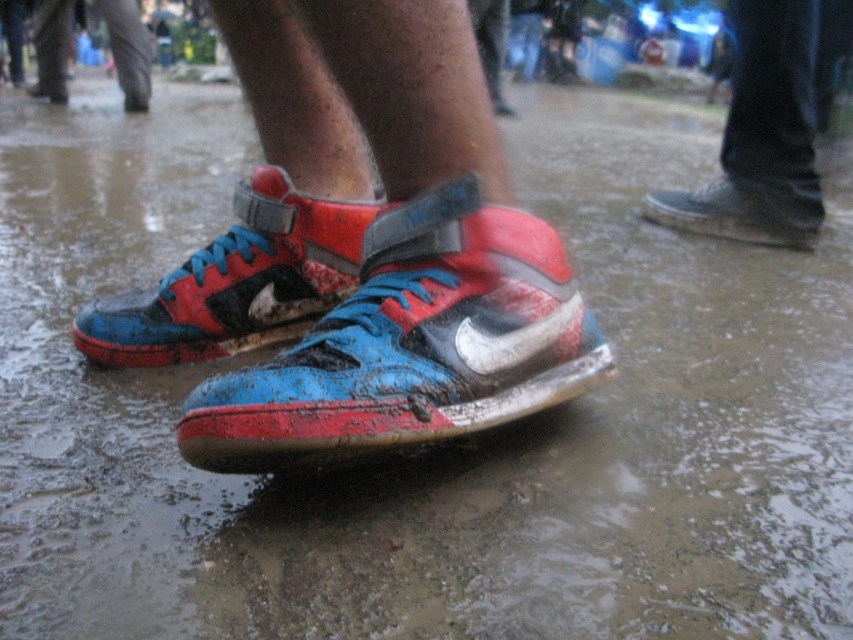
Question: Which object appears farthest from the camera in this image?

Choices:
 (A) matte black shoe at center
 (B) blue matte/suede sneaker at center
 (C) shiny leather sneakers at center
 (D) blue suede shoe at upper right

Answer: (D)

Question: Which of the following is the closest to the observer?

Choices:
 (A) (292, 218)
 (B) (773, 164)

Answer: (A)

Question: Is shiny leather sneakers at center smaller than blue suede shoe at upper right?

Choices:
 (A) yes
 (B) no

Answer: (B)

Question: Which of the following is the closest to the observer?

Choices:
 (A) (476, 294)
 (B) (196, 276)

Answer: (A)

Question: Considering the relative positions of shiny leather sneakers at center and blue matte/suede sneaker at center in the image provided, where is shiny leather sneakers at center located with respect to blue matte/suede sneaker at center?

Choices:
 (A) right
 (B) left

Answer: (A)

Question: Does blue matte/suede sneaker at center have a larger size compared to matte black shoe at center?

Choices:
 (A) no
 (B) yes

Answer: (A)